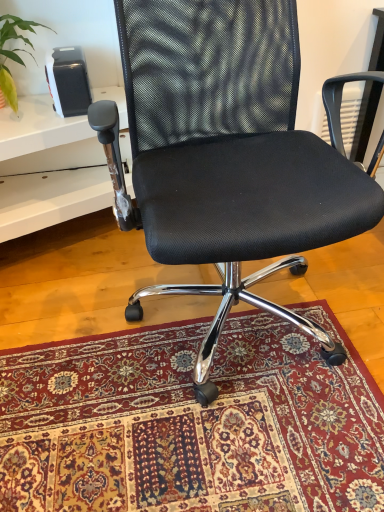
Question: Considering the relative sizes of green leafy plant at upper left and carpeted rug at center in the image provided, is green leafy plant at upper left smaller than carpeted rug at center?

Choices:
 (A) no
 (B) yes

Answer: (B)

Question: Is green leafy plant at upper left to the left of carpeted rug at center from the viewer's perspective?

Choices:
 (A) no
 (B) yes

Answer: (B)

Question: Is green leafy plant at upper left wider than carpeted rug at center?

Choices:
 (A) yes
 (B) no

Answer: (B)

Question: Is green leafy plant at upper left not within carpeted rug at center?

Choices:
 (A) yes
 (B) no

Answer: (A)

Question: Can you confirm if green leafy plant at upper left is thinner than carpeted rug at center?

Choices:
 (A) no
 (B) yes

Answer: (B)

Question: From a real-world perspective, relative to green leafy plant at upper left, is white plastic table at left vertically above or below?

Choices:
 (A) below
 (B) above

Answer: (A)

Question: Is white plastic table at left wider or thinner than green leafy plant at upper left?

Choices:
 (A) thin
 (B) wide

Answer: (B)

Question: Is white plastic table at left spatially inside green leafy plant at upper left, or outside of it?

Choices:
 (A) inside
 (B) outside

Answer: (B)

Question: Does point (31, 188) appear closer or farther from the camera than point (34, 30)?

Choices:
 (A) farther
 (B) closer

Answer: (A)

Question: Is green leafy plant at upper left inside or outside of carpeted rug at center?

Choices:
 (A) inside
 (B) outside

Answer: (B)

Question: Looking at the image, does green leafy plant at upper left seem bigger or smaller compared to carpeted rug at center?

Choices:
 (A) small
 (B) big

Answer: (A)

Question: Considering the positions of point (26, 39) and point (294, 380), is point (26, 39) closer or farther from the camera than point (294, 380)?

Choices:
 (A) farther
 (B) closer

Answer: (A)

Question: Would you say green leafy plant at upper left is to the left or to the right of carpeted rug at center in the picture?

Choices:
 (A) left
 (B) right

Answer: (A)

Question: Considering the positions of point (11, 26) and point (226, 27), is point (11, 26) closer or farther from the camera than point (226, 27)?

Choices:
 (A) closer
 (B) farther

Answer: (B)

Question: From the image's perspective, relative to black mesh office chair at center, is green leafy plant at upper left above or below?

Choices:
 (A) above
 (B) below

Answer: (A)